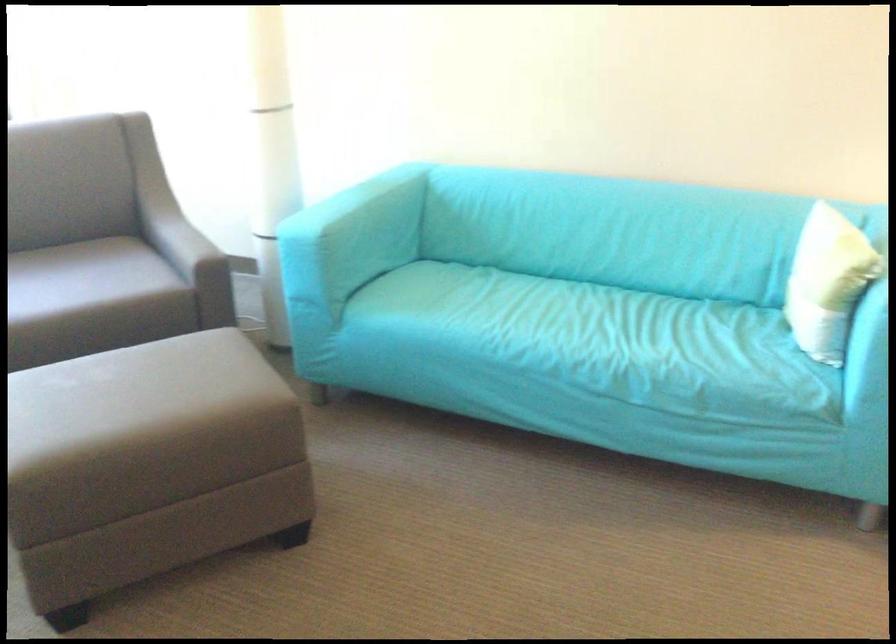
The location [149,464] corresponds to which object?

This point indicates the grey ottoman.